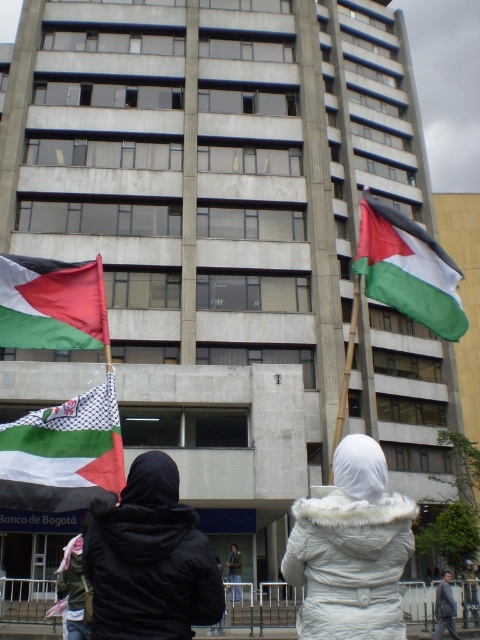
You are a photographer standing in front of the building and want to take a photo of both the black matte jacket at lower left and the black matte jacket at center without any obstruction. Which jacket should you position closer to the camera to ensure both are visible clearly?

The black matte jacket at lower left is in front of the black matte jacket at center. To ensure both are visible without obstruction, position the black matte jacket at center closer to the camera so that it is not blocked by the one in front.